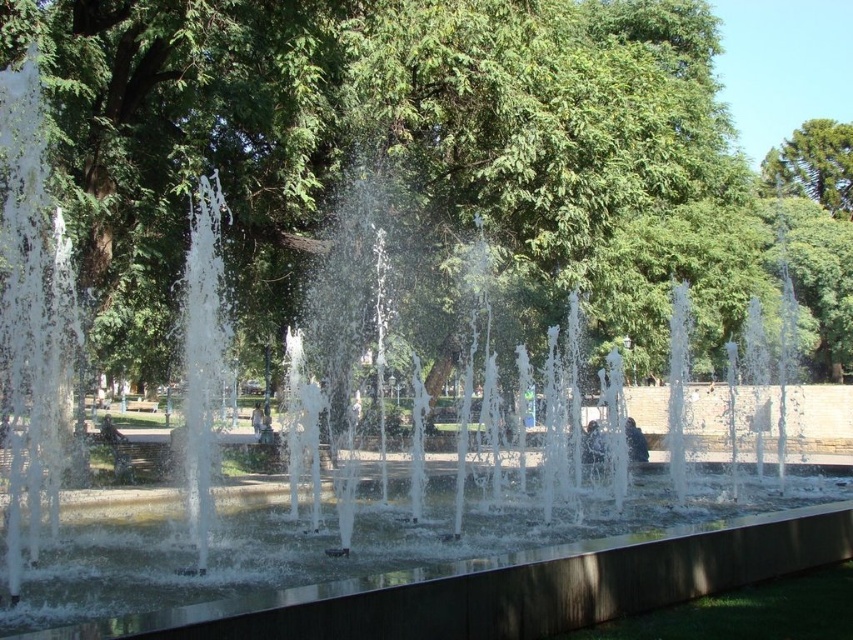
Between green leafy tree at center and green leafy tree at upper right, which one is positioned lower?

green leafy tree at center is below.

Who is more distant from viewer, [425,195] or [850,218]?

The point [850,218] is behind.

The width and height of the screenshot is (853, 640). What do you see at coordinates (421, 161) in the screenshot?
I see `green leafy tree at center` at bounding box center [421, 161].

You are a GUI agent. You are given a task and a screenshot of the screen. Output one action in this format:
    pyautogui.click(x=<x>, y=<y>)
    Task: Click on the green leafy tree at center
    
    Given the screenshot: What is the action you would take?
    pyautogui.click(x=421, y=161)